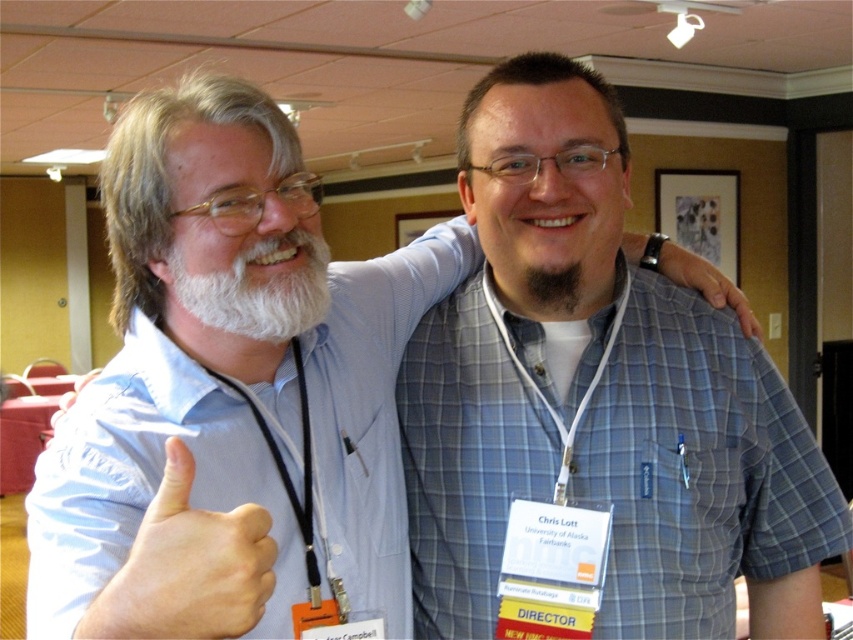
Imagine you are taking a photo of the two people in the scene. You notice two points marked in the image at coordinates point (265, 301) and point (570, 296). If you want to focus on the closer point to ensure the subject is sharp, which coordinate should you choose?

Point (265, 301) is closer to the viewer than point (570, 296), so you should focus on point (265, 301) to ensure the subject is sharp.

You are a photographer at an event and need to arrange two people for a photo. You see a skinny white hand at center and a dark brown fuzzy beard at center. Which object is on the left side when looking at the scene?

The skinny white hand at center is positioned on the left side of the dark brown fuzzy beard at center.